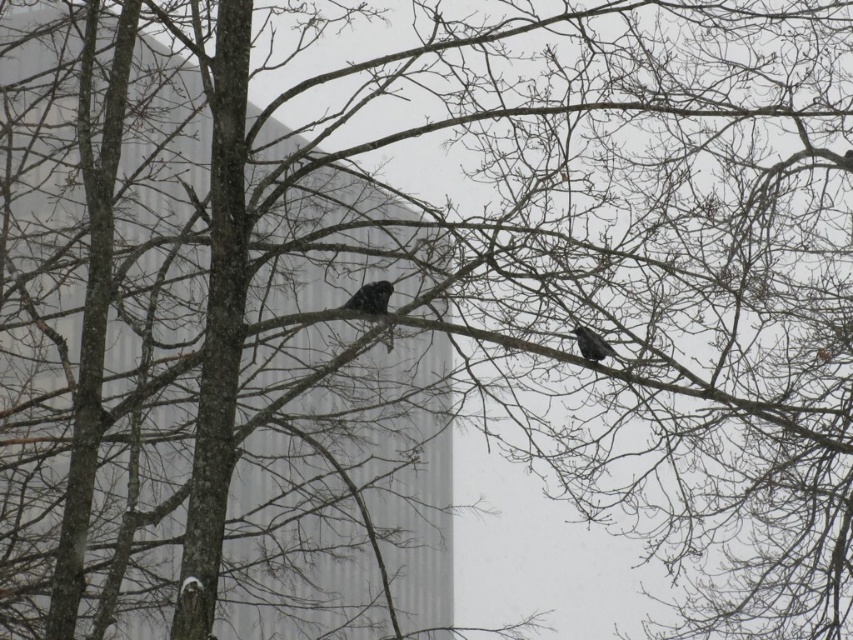
You are an ornithologist observing two birds in a winter landscape. You notice a spotted black bird at center and a black matte bird at center right. Which bird has a larger width according to your observations?

The spotted black bird at center might be wider than black matte bird at center right.

You are an ornithologist observing two birds in a winter landscape with bare trees. You notice a spotted black bird at center and a black matte bird at center right. Which bird is closer to you?

The spotted black bird at center is closer to you than the black matte bird at center right.

You are an ornithologist observing two birds in a winter scene with bare trees and a modern building in the background. You notice the spotted black bird at center and the black matte bird at center right. Which bird would cast a larger shadow on the ground?

The spotted black bird at center is bigger than the black matte bird at center right, so it would cast a larger shadow on the ground.